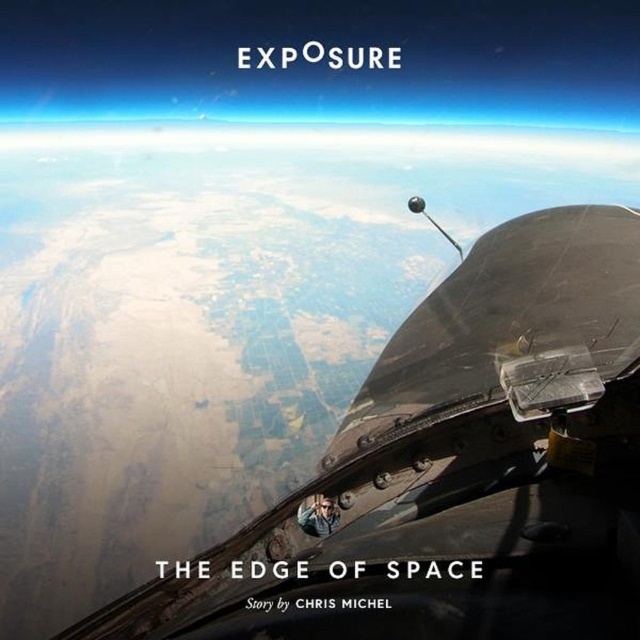
You are an astronaut inside the spacecraft and want to reach the shiny metallic cockpit at center to adjust the controls. However, your current position is near the matte black helmet at center. Which direction should you move to reach the cockpit?

The shiny metallic cockpit at center is to the right of the matte black helmet at center, so you should move to your right to reach the cockpit.

You are an astronaut inside the spacecraft and need to check the controls. Which object, the shiny metallic cockpit at center or the matte black helmet at center, is taller and would require you to look up more to see?

The shiny metallic cockpit at center is taller than the matte black helmet at center, so you would need to look up more to see the shiny metallic cockpit at center.

Consider the image. You are an astronaut inside the spacecraft and need to check the visibility through the shiny metallic cockpit at center and the matte black helmet at center. Which object has a wider field of view based on their sizes?

The shiny metallic cockpit at center has a wider field of view because its width is larger than the matte black helmet at center.